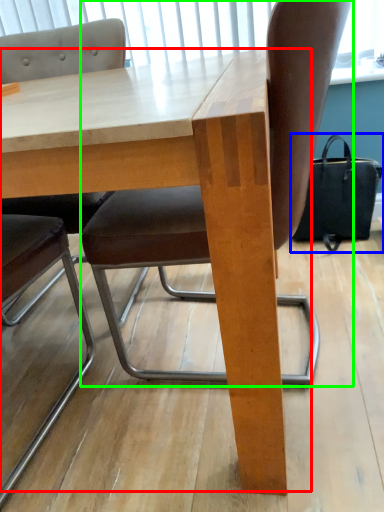
Question: Which object is the closest to the table (highlighted by a red box)? Choose among these: handbag (highlighted by a blue box) or chair (highlighted by a green box).

Choices:
 (A) handbag
 (B) chair

Answer: (B)